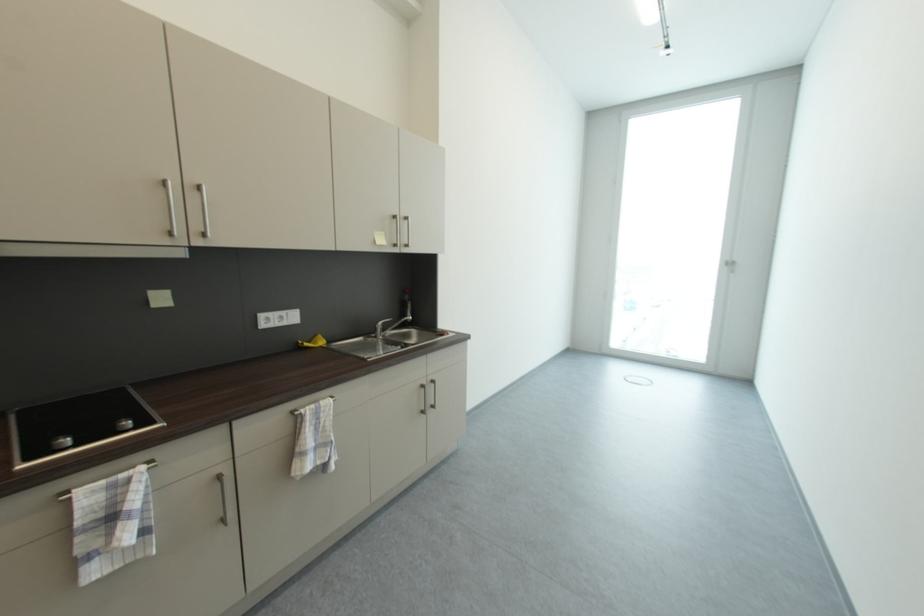
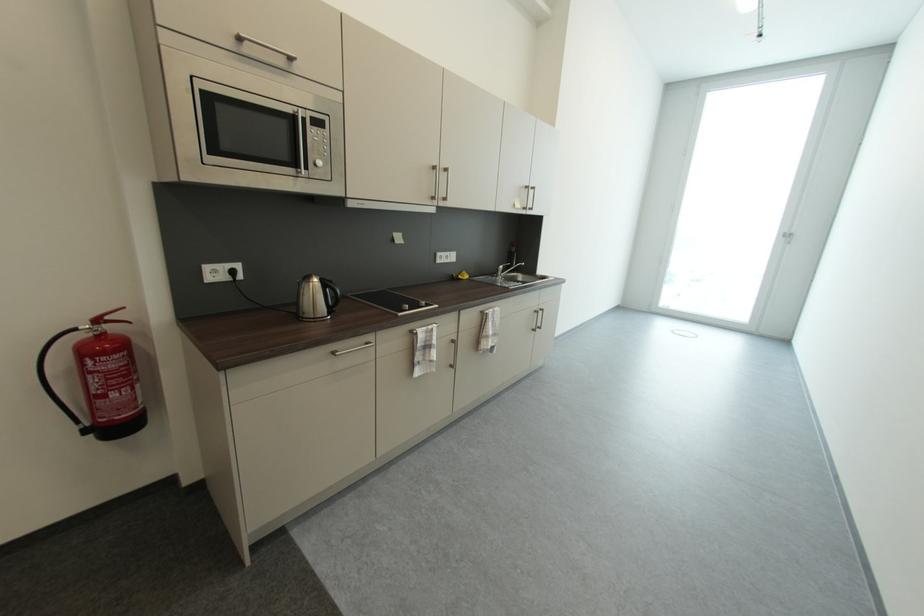
Find the pixel in the second image that matches the point at 381,336 in the first image.

(502, 277)